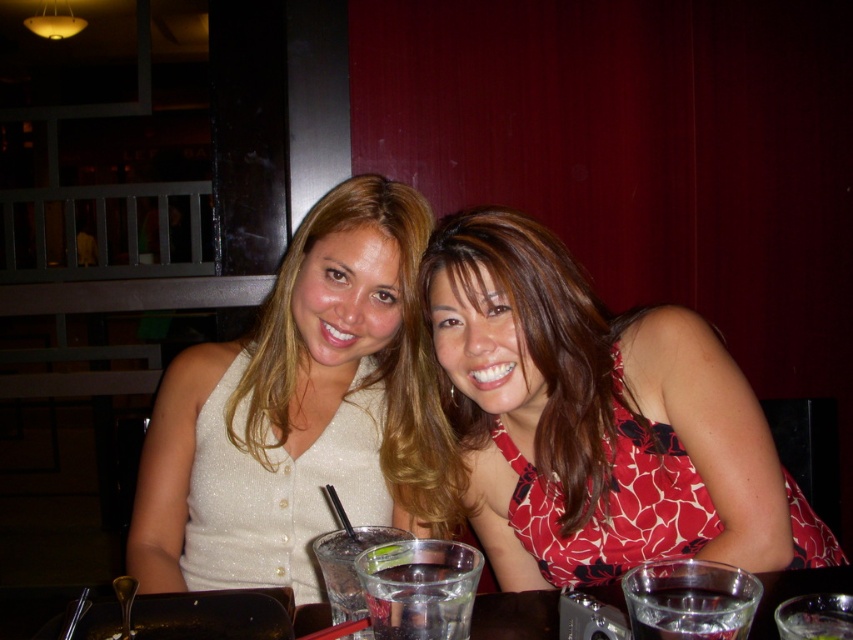
Question: Where is matte white blouse at center located in relation to clear glass at center in the image?

Choices:
 (A) above
 (B) below

Answer: (A)

Question: Based on their relative distances, which object is farther from the clear glass water at lower center?

Choices:
 (A) white glittery top at center
 (B) red floral dress at center

Answer: (A)

Question: Is white glittery top at center below clear glass at center?

Choices:
 (A) yes
 (B) no

Answer: (B)

Question: Which point is farther from the camera taking this photo?

Choices:
 (A) [376, 502]
 (B) [207, 401]
 (C) [418, 604]
 (D) [408, 228]

Answer: (B)

Question: Observing the image, what is the correct spatial positioning of matte white blouse at center in reference to red floral dress at center?

Choices:
 (A) left
 (B) right

Answer: (A)

Question: Which point appears farthest from the camera in this image?

Choices:
 (A) (364, 492)
 (B) (258, 339)
 (C) (407, 348)

Answer: (B)